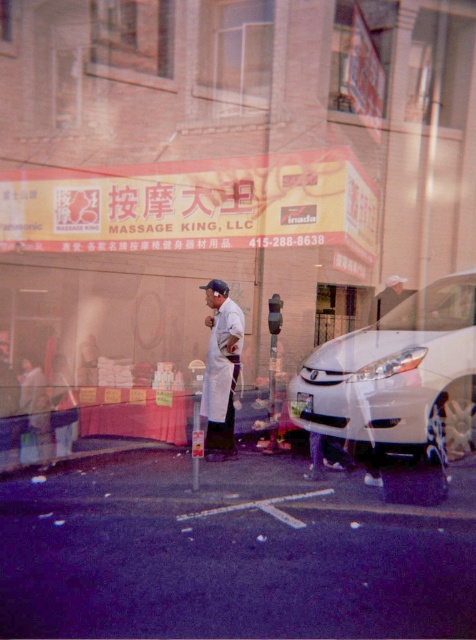
Question: Is yellow matte signboard at center below white matte hat at upper center?

Choices:
 (A) no
 (B) yes

Answer: (B)

Question: Which is nearer to the white matte hat at upper center?

Choices:
 (A) white lab coat at center
 (B) white glossy car at right
 (C) matte white robe at lower left
 (D) yellow matte signboard at center

Answer: (D)

Question: Is white glossy car at right smaller than matte white robe at lower left?

Choices:
 (A) yes
 (B) no

Answer: (B)

Question: Which point is closer to the camera?

Choices:
 (A) white lab coat at center
 (B) white matte hat at upper center
 (C) white glossy car at right

Answer: (C)

Question: Can you confirm if white glossy car at right is bigger than matte white robe at lower left?

Choices:
 (A) yes
 (B) no

Answer: (A)

Question: Considering the real-world distances, which object is closest to the white lab coat at center?

Choices:
 (A) white glossy car at right
 (B) white matte hat at upper center
 (C) yellow matte signboard at center
 (D) matte white robe at lower left

Answer: (A)